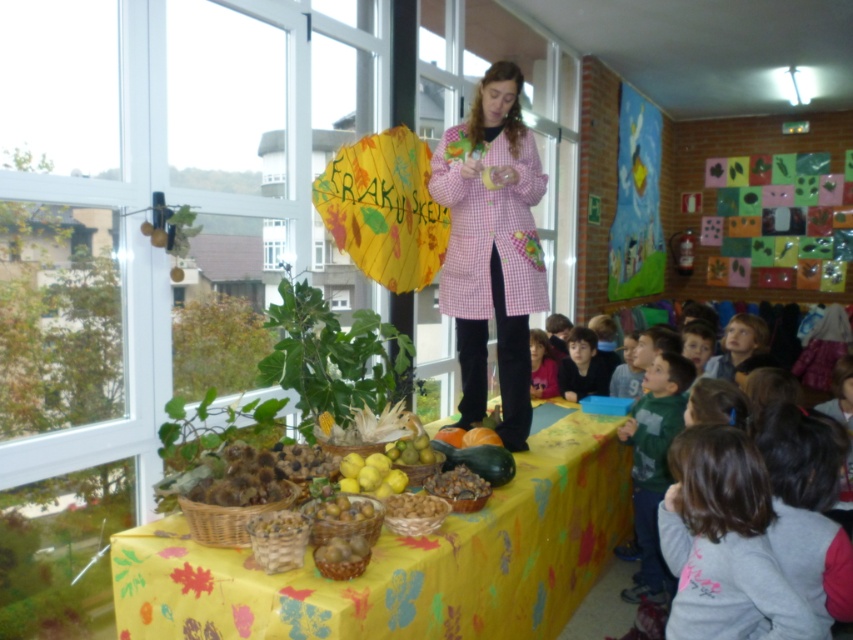
Question: Among these objects, which one is nearest to the camera?

Choices:
 (A) dark brown hair at lower right
 (B) yellow paper umbrella at center
 (C) green cotton shirt at lower right

Answer: (A)

Question: Does pink gingham coat at center have a larger size compared to yellow paper umbrella at center?

Choices:
 (A) yes
 (B) no

Answer: (A)

Question: Which object is the farthest from the brown hair at lower right?

Choices:
 (A) yellow paper umbrella at center
 (B) brown textured nuts at center
 (C) pink gingham coat at center
 (D) yellow matte lemons at center

Answer: (D)

Question: Is the position of green cotton shirt at lower right less distant than that of yellow matte lemon at center?

Choices:
 (A) no
 (B) yes

Answer: (A)

Question: Can you confirm if yellow fabric table at center is positioned to the right of yellow matte lemons at center?

Choices:
 (A) no
 (B) yes

Answer: (B)

Question: Which of these objects is positioned closest to the brown textured nuts at center?

Choices:
 (A) yellow matte lemons at center
 (B) brown hair at lower right

Answer: (A)